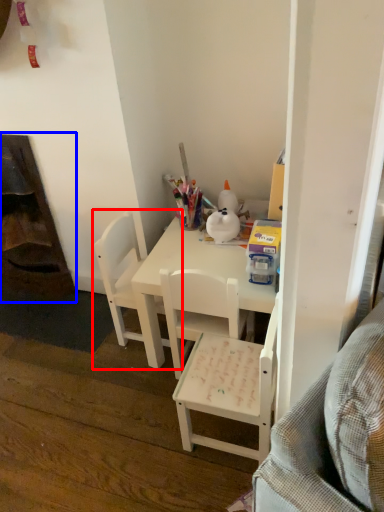
Question: Among these objects, which one is nearest to the camera, chair (highlighted by a red box) or fireplace (highlighted by a blue box)?

Choices:
 (A) chair
 (B) fireplace

Answer: (A)